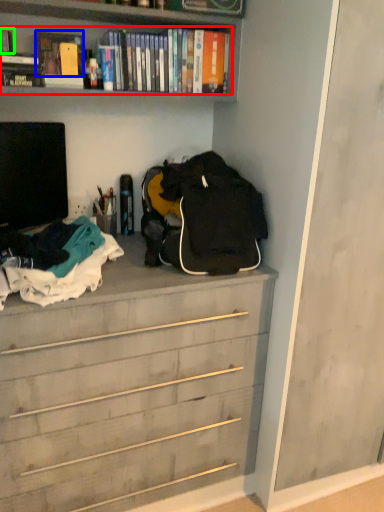
Question: Estimate the real-world distances between objects in this image. Which object is closer to book (highlighted by a red box), book (highlighted by a blue box) or book (highlighted by a green box)?

Choices:
 (A) book
 (B) book

Answer: (A)